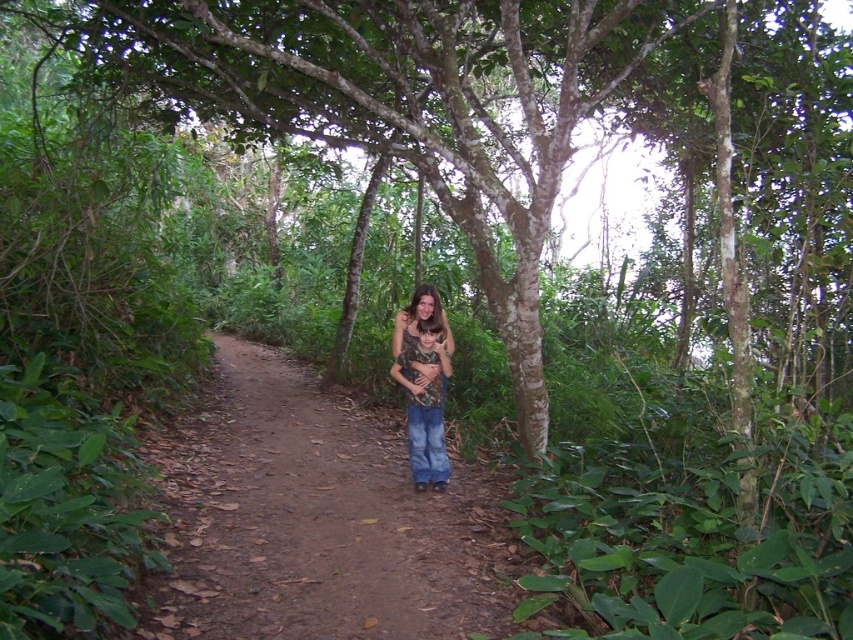
Question: Does brown dirt path at center have a lesser width compared to camo fabric shirt at center?

Choices:
 (A) no
 (B) yes

Answer: (A)

Question: Among these objects, which one is farthest from the camera?

Choices:
 (A) brown dirt path at center
 (B) camo fabric shirt at center

Answer: (B)

Question: Observing the image, what is the correct spatial positioning of brown dirt path at center in reference to camo fabric shirt at center?

Choices:
 (A) right
 (B) left

Answer: (B)

Question: Is brown dirt path at center smaller than camo fabric shirt at center?

Choices:
 (A) yes
 (B) no

Answer: (B)

Question: Which of the following is the farthest from the observer?

Choices:
 (A) brown dirt path at center
 (B) camo fabric shirt at center

Answer: (B)

Question: Which point is farther to the camera?

Choices:
 (A) brown dirt path at center
 (B) camo fabric shirt at center

Answer: (B)